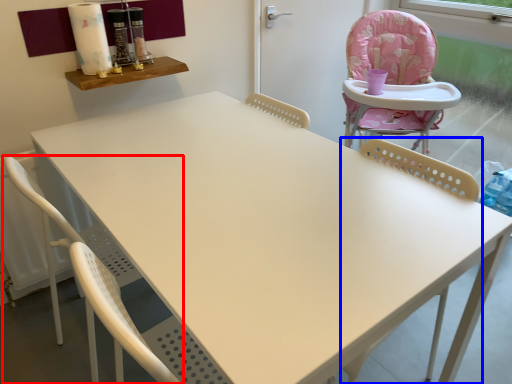
Question: Which object is further to the camera taking this photo, chair (highlighted by a red box) or chair (highlighted by a blue box)?

Choices:
 (A) chair
 (B) chair

Answer: (A)